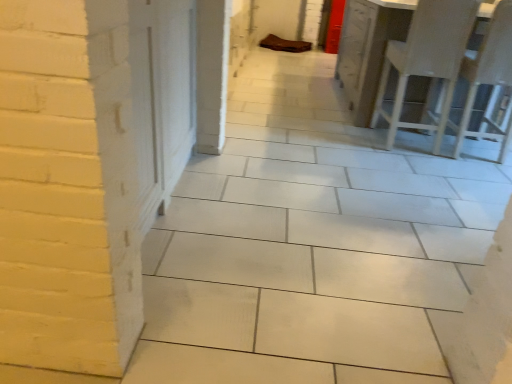
Question: Is white wood chairs at right spatially inside white plastic chair at right, or outside of it?

Choices:
 (A) inside
 (B) outside

Answer: (B)

Question: In terms of height, does white wood chairs at right look taller or shorter compared to white plastic chair at right?

Choices:
 (A) short
 (B) tall

Answer: (A)

Question: Would you say white wood chairs at right is to the left or to the right of white plastic chair at right in the picture?

Choices:
 (A) left
 (B) right

Answer: (A)

Question: From their relative heights in the image, would you say white plastic chair at right is taller or shorter than white wood chairs at right?

Choices:
 (A) tall
 (B) short

Answer: (A)

Question: Considering their positions, is white plastic chair at right located in front of or behind white wood chairs at right?

Choices:
 (A) behind
 (B) front

Answer: (B)

Question: Based on their sizes in the image, would you say white plastic chair at right is bigger or smaller than white wood chairs at right?

Choices:
 (A) small
 (B) big

Answer: (A)

Question: From a real-world perspective, is white plastic chair at right above or below white wood chairs at right?

Choices:
 (A) above
 (B) below

Answer: (A)